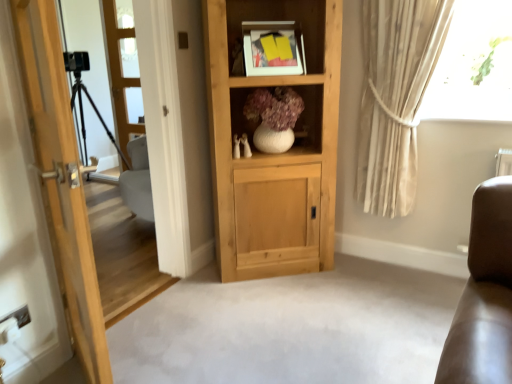
Question: Should I look upward or downward to see matte white picture frame at upper center?

Choices:
 (A) down
 (B) up

Answer: (B)

Question: From a real-world perspective, is beige fabric curtain at upper right below black matte tripod at left, which appears as the 1th screen door when viewed from the left?

Choices:
 (A) no
 (B) yes

Answer: (A)

Question: Could you tell me if beige fabric curtain at upper right is facing black matte tripod at left, which appears as the 1th screen door when viewed from the left?

Choices:
 (A) yes
 (B) no

Answer: (B)

Question: Is the surface of beige fabric curtain at upper right in direct contact with black matte tripod at left, which appears as the 1th screen door when viewed from the left?

Choices:
 (A) no
 (B) yes

Answer: (A)

Question: Would you consider beige fabric curtain at upper right to be distant from black matte tripod at left, which appears as the 1th screen door when viewed from the left?

Choices:
 (A) yes
 (B) no

Answer: (A)

Question: Can you confirm if beige fabric curtain at upper right is shorter than black matte tripod at left, which appears as the 1th screen door when viewed from the left?

Choices:
 (A) yes
 (B) no

Answer: (A)

Question: Is the depth of beige fabric curtain at upper right less than that of black matte tripod at left, acting as the 2th screen door starting from the right?

Choices:
 (A) no
 (B) yes

Answer: (B)

Question: Considering the relative sizes of black matte tripod at left, which appears as the 1th screen door when viewed from the left, and matte white picture frame at upper center in the image provided, is black matte tripod at left, which appears as the 1th screen door when viewed from the left, bigger than matte white picture frame at upper center?

Choices:
 (A) no
 (B) yes

Answer: (B)

Question: Is black matte tripod at left, acting as the 2th screen door starting from the right, positioned in front of matte white picture frame at upper center?

Choices:
 (A) no
 (B) yes

Answer: (A)

Question: Is black matte tripod at left, which appears as the 1th screen door when viewed from the left, taller than matte white picture frame at upper center?

Choices:
 (A) yes
 (B) no

Answer: (A)

Question: Is black matte tripod at left, acting as the 2th screen door starting from the right, facing away from matte white picture frame at upper center?

Choices:
 (A) no
 (B) yes

Answer: (A)

Question: Can you confirm if black matte tripod at left, acting as the 2th screen door starting from the right, is positioned to the right of matte white picture frame at upper center?

Choices:
 (A) yes
 (B) no

Answer: (B)

Question: Would you say black matte tripod at left, which appears as the 1th screen door when viewed from the left, is outside matte white picture frame at upper center?

Choices:
 (A) no
 (B) yes

Answer: (B)

Question: Is natural wood cabinet at center positioned in front of clear glass door at left, the 1th screen door when ordered from right to left?

Choices:
 (A) no
 (B) yes

Answer: (B)